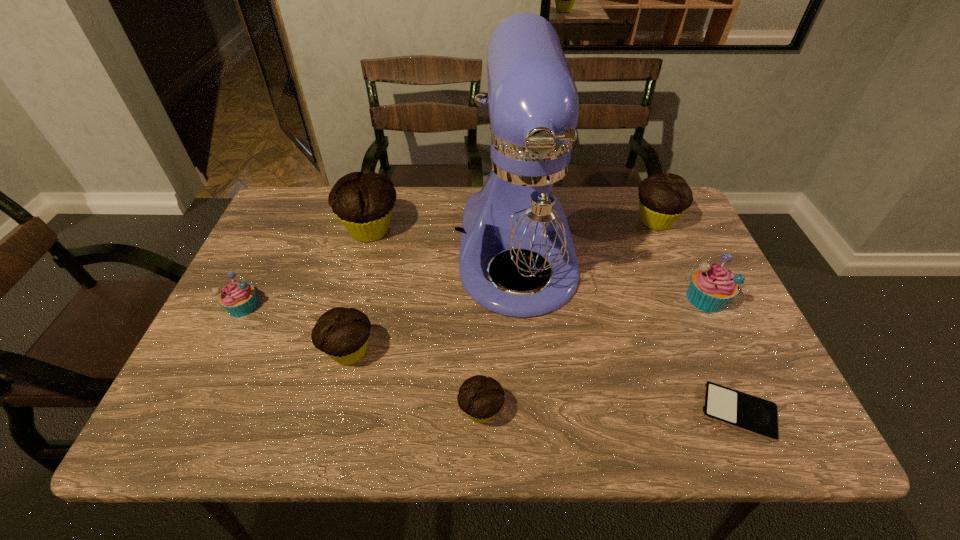
Find the location of a particular element. Image resolution: width=960 pixels, height=540 pixels. blue mixer is located at coordinates (526, 209).

Where is `mixer`? Image resolution: width=960 pixels, height=540 pixels. mixer is located at coordinates [x=526, y=209].

You are a GUI agent. You are given a task and a screenshot of the screen. Output one action in this format:
    pyautogui.click(x=<x>, y=<y>)
    Task: Click on the seventh shortest object
    
    Given the screenshot: What is the action you would take?
    pyautogui.click(x=363, y=202)

Locate an element on the screen. the tallest muffin is located at coordinates (363, 202).

Where is `the third tallest object`? the third tallest object is located at coordinates click(663, 198).

Locate an element on the screen. The image size is (960, 540). the fifth shortest muffin is located at coordinates (663, 198).

The image size is (960, 540). In order to click on the right blue muffin in this screenshot , I will do `click(712, 287)`.

At what (x,y) coordinates should I click in order to perform the action: click on the second nearest muffin. Please return your answer as a coordinate pair (x, y). The width and height of the screenshot is (960, 540). Looking at the image, I should click on (342, 333).

The image size is (960, 540). I want to click on the third biggest chocolate muffin, so click(342, 333).

Image resolution: width=960 pixels, height=540 pixels. Find the location of `the leftmost muffin`. the leftmost muffin is located at coordinates (238, 298).